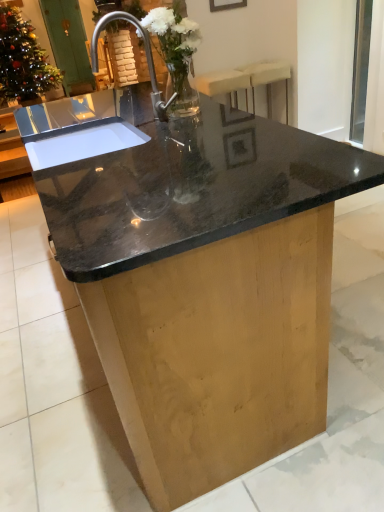
The image size is (384, 512). What do you see at coordinates (226, 4) in the screenshot?
I see `matte black picture frame at upper center` at bounding box center [226, 4].

The width and height of the screenshot is (384, 512). What do you see at coordinates (23, 60) in the screenshot? I see `translucent glass vase at upper left, which is counted as the first floral arrangement, starting from the back` at bounding box center [23, 60].

In order to face translucent glass vase at upper left, which appears as the 1th floral arrangement when viewed from the top, should I rotate leftwards or rightwards?

Turn left approximately 22.184 degrees to face it.

You are a GUI agent. You are given a task and a screenshot of the screen. Output one action in this format:
    pyautogui.click(x=<x>, y=<y>)
    Task: Click on the transparent glass window screen at upper right
    Image resolution: width=384 pixels, height=512 pixels.
    Given the screenshot: What is the action you would take?
    pyautogui.click(x=360, y=69)

Identify the location of green wooden screen door at upper left. (68, 44).

This screenshot has width=384, height=512. What do you see at coordinates (68, 44) in the screenshot?
I see `green wooden screen door at upper left` at bounding box center [68, 44].

Find the location of a particular element. This screenshot has width=384, height=512. matte black picture frame at upper center is located at coordinates (226, 4).

Could you tell me if clear glass vase at center, positioned as the second floral arrangement in left-to-right order, is turned towards beige fabric bar stool at upper right?

No, clear glass vase at center, positioned as the second floral arrangement in left-to-right order, is not oriented towards beige fabric bar stool at upper right.

Is beige fabric bar stool at upper right surrounded by clear glass vase at center, the second floral arrangement viewed from the top?

No, beige fabric bar stool at upper right is not inside clear glass vase at center, the second floral arrangement viewed from the top.

Is clear glass vase at center, which is counted as the second floral arrangement, starting from the back, far from beige fabric bar stool at upper right?

Absolutely, clear glass vase at center, which is counted as the second floral arrangement, starting from the back, is distant from beige fabric bar stool at upper right.

How many degrees apart are the facing directions of clear glass vase at center, the second floral arrangement viewed from the top, and beige fabric bar stool at upper right?

91.7 degrees separate the facing orientations of clear glass vase at center, the second floral arrangement viewed from the top, and beige fabric bar stool at upper right.

Can you tell me how much beige fabric bar stool at upper right and matte black picture frame at upper center differ in facing direction?

beige fabric bar stool at upper right and matte black picture frame at upper center are facing 0.0099 degrees away from each other.

From the image's perspective, which one is positioned lower, beige fabric bar stool at upper right or matte black picture frame at upper center?

beige fabric bar stool at upper right.

Where is `picture frame above the beige fabric bar stool at upper right (from a real-world perspective)`? This screenshot has height=512, width=384. picture frame above the beige fabric bar stool at upper right (from a real-world perspective) is located at coordinates (226, 4).

Does beige fabric bar stool at upper right come in front of matte black picture frame at upper center?

No.

Is matte black picture frame at upper center positioned far away from beige fabric bar stool at upper right?

That's not correct — matte black picture frame at upper center is a little close to beige fabric bar stool at upper right.

How far apart are matte black picture frame at upper center and beige fabric bar stool at upper right?

A distance of 21.98 inches exists between matte black picture frame at upper center and beige fabric bar stool at upper right.

You are a GUI agent. You are given a task and a screenshot of the screen. Output one action in this format:
    pyautogui.click(x=<x>, y=<y>)
    Task: Click on the picture frame on the left of the beige fabric bar stool at upper right
    
    Given the screenshot: What is the action you would take?
    pyautogui.click(x=226, y=4)

From a real-world perspective, which object rests below the other?

beige fabric bar stool at upper right, from a real-world perspective.

From a real-world perspective, is clear glass vase at center, the second floral arrangement viewed from the top, on polished stainless steel sink at center?

Yes.

Is clear glass vase at center, positioned as the second floral arrangement in left-to-right order, outside of polished stainless steel sink at center?

No, most part of clear glass vase at center, positioned as the second floral arrangement in left-to-right order, lies within polished stainless steel sink at center.

Does clear glass vase at center, which is counted as the second floral arrangement, starting from the back, appear on the right side of polished stainless steel sink at center?

Indeed, clear glass vase at center, which is counted as the second floral arrangement, starting from the back, is positioned on the right side of polished stainless steel sink at center.

Looking at this image, is clear glass vase at center, which is counted as the second floral arrangement, starting from the back, positioned with its back to polished stainless steel sink at center?

Yes, clear glass vase at center, which is counted as the second floral arrangement, starting from the back, is facing away from polished stainless steel sink at center.

Is transparent glass window screen at upper right inside or outside of green wooden screen door at upper left?

transparent glass window screen at upper right is not enclosed by green wooden screen door at upper left.

Based on the photo, who is shorter, transparent glass window screen at upper right or green wooden screen door at upper left?

transparent glass window screen at upper right is shorter.

How different are the orientations of transparent glass window screen at upper right and green wooden screen door at upper left in degrees?

transparent glass window screen at upper right and green wooden screen door at upper left are facing 89.6 degrees away from each other.

Does green wooden screen door at upper left lie in front of matte black picture frame at upper center?

No, the depth of green wooden screen door at upper left is greater than that of matte black picture frame at upper center.

Is green wooden screen door at upper left placed right next to matte black picture frame at upper center?

No.

How different are the orientations of green wooden screen door at upper left and matte black picture frame at upper center in degrees?

They differ by 1.63 degrees in their facing directions.

Looking at this image, from the image's perspective, is green wooden screen door at upper left over matte black picture frame at upper center?

Yes, from the image's perspective, green wooden screen door at upper left is on top of matte black picture frame at upper center.

Visually, is clear glass vase at center, positioned as the second floral arrangement in left-to-right order, positioned to the left or to the right of matte black picture frame at upper center?

clear glass vase at center, positioned as the second floral arrangement in left-to-right order, is positioned on matte black picture frame at upper center's left side.

The width and height of the screenshot is (384, 512). There is a matte black picture frame at upper center. Identify the location of the 1st floral arrangement below it (from a real-world perspective). (175, 57).

Is clear glass vase at center, positioned as the second floral arrangement in left-to-right order, taller or shorter than matte black picture frame at upper center?

Clearly, clear glass vase at center, positioned as the second floral arrangement in left-to-right order, is taller compared to matte black picture frame at upper center.

Is point (188, 25) behind point (225, 6)?

No, (188, 25) is in front of (225, 6).

Find the location of a particular element. This screenshot has height=512, width=384. bar stool on the right of clear glass vase at center, positioned as the 1th floral arrangement in front-to-back order is located at coordinates (268, 79).

The height and width of the screenshot is (512, 384). Identify the location of picture frame above the beige fabric bar stool at upper right (from a real-world perspective). (226, 4).

Estimate the real-world distances between objects in this image. Which object is further from green wooden screen door at upper left, clear glass vase at center, positioned as the second floral arrangement in left-to-right order, or transparent glass window screen at upper right?

clear glass vase at center, positioned as the second floral arrangement in left-to-right order, is positioned further to the anchor green wooden screen door at upper left.

Which object lies nearer to the anchor point beige fabric bar stool at upper right, transparent glass window screen at upper right or clear glass vase at center, which is counted as the 1th floral arrangement, starting from the right?

transparent glass window screen at upper right is positioned closer to the anchor beige fabric bar stool at upper right.

Based on their spatial positions, is green wooden screen door at upper left or translucent glass vase at upper left, which is the second floral arrangement in bottom-to-top order, further from polished stainless steel sink at center?

translucent glass vase at upper left, which is the second floral arrangement in bottom-to-top order.

Looking at the image, which one is located closer to matte black picture frame at upper center, clear glass vase at center, which is counted as the second floral arrangement, starting from the back, or polished stainless steel sink at center?

clear glass vase at center, which is counted as the second floral arrangement, starting from the back, is closer to matte black picture frame at upper center.

Based on their spatial positions, is transparent glass window screen at upper right or clear glass vase at center, which is counted as the second floral arrangement, starting from the back, closer to translucent glass vase at upper left, which appears as the first floral arrangement when viewed from the left?

clear glass vase at center, which is counted as the second floral arrangement, starting from the back, lies closer to translucent glass vase at upper left, which appears as the first floral arrangement when viewed from the left, than the other object.

Based on their spatial positions, is polished stainless steel sink at center or transparent glass window screen at upper right closer to beige fabric bar stool at upper right?

The object closer to beige fabric bar stool at upper right is transparent glass window screen at upper right.

Which object lies further to the anchor point translucent glass vase at upper left, which is the second floral arrangement in bottom-to-top order, matte black picture frame at upper center or beige fabric bar stool at upper right?

Based on the image, beige fabric bar stool at upper right appears to be further to translucent glass vase at upper left, which is the second floral arrangement in bottom-to-top order.

Based on their spatial positions, is clear glass vase at center, positioned as the 1th floral arrangement in front-to-back order, or translucent glass vase at upper left, which appears as the first floral arrangement when viewed from the left, further from green wooden screen door at upper left?

Among the two, clear glass vase at center, positioned as the 1th floral arrangement in front-to-back order, is located further to green wooden screen door at upper left.

Locate an element on the screen. picture frame between clear glass vase at center, which is counted as the 1th floral arrangement, starting from the right, and beige fabric bar stool at upper right from front to back is located at coordinates [x=226, y=4].

The image size is (384, 512). I want to click on bar stool between transparent glass window screen at upper right and green wooden screen door at upper left along the z-axis, so click(x=268, y=79).

This screenshot has height=512, width=384. Find the location of `picture frame between clear glass vase at center, positioned as the second floral arrangement in left-to-right order, and green wooden screen door at upper left from front to back`. picture frame between clear glass vase at center, positioned as the second floral arrangement in left-to-right order, and green wooden screen door at upper left from front to back is located at coordinates (226, 4).

Where is `bar stool between polished stainless steel sink at center and green wooden screen door at upper left along the z-axis`? The height and width of the screenshot is (512, 384). bar stool between polished stainless steel sink at center and green wooden screen door at upper left along the z-axis is located at coordinates (268, 79).